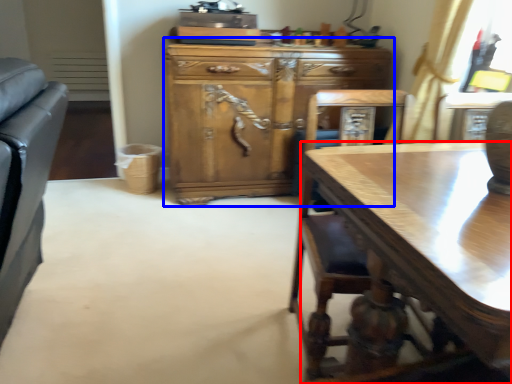
Question: Which object appears farthest to the camera in this image, desk (highlighted by a red box) or cabinetry (highlighted by a blue box)?

Choices:
 (A) desk
 (B) cabinetry

Answer: (B)